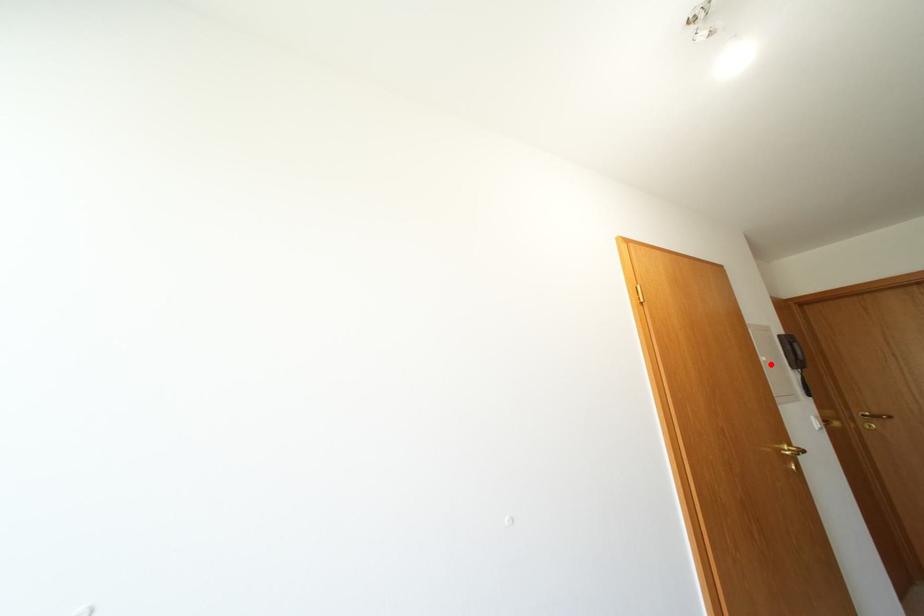
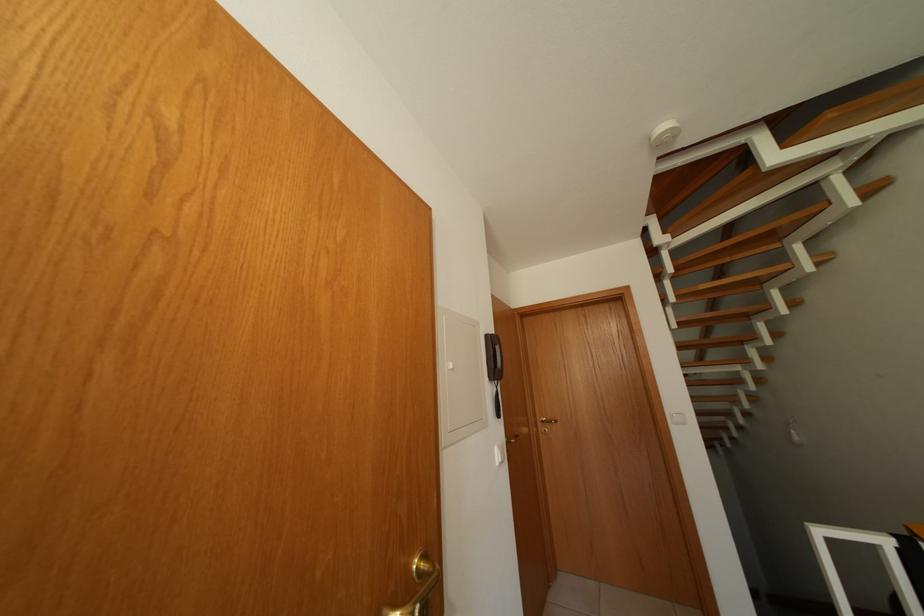
Find the pixel in the second image that matches the highlighted location in the first image.

(455, 371)